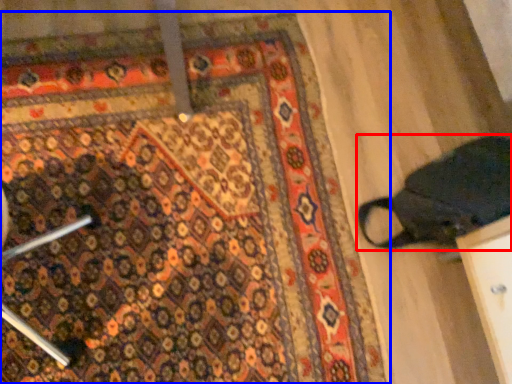
Question: Among these objects, which one is farthest to the camera, footwear (highlighted by a red box) or mat (highlighted by a blue box)?

Choices:
 (A) footwear
 (B) mat

Answer: (B)